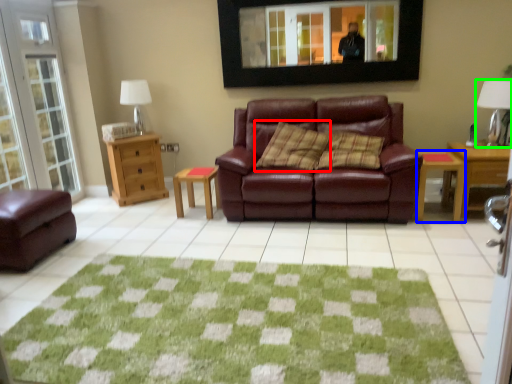
Question: Estimate the real-world distances between objects in this image. Which object is closer to pillow (highlighted by a red box), table (highlighted by a blue box) or lamp (highlighted by a green box)?

Choices:
 (A) table
 (B) lamp

Answer: (A)